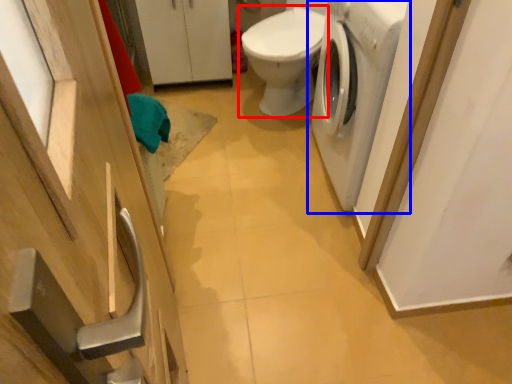
Question: Among these objects, which one is farthest to the camera, toilet (highlighted by a red box) or washing machine (highlighted by a blue box)?

Choices:
 (A) toilet
 (B) washing machine

Answer: (A)